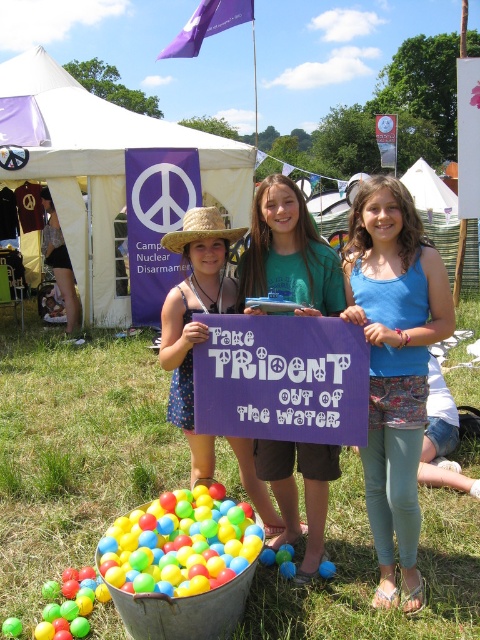
You are a photographer standing at the center of the scene. You want to take a photo that includes both point (384, 467) and point (167, 232). Which point will appear larger in your photo?

Point (384, 467) is closer to the camera than point (167, 232), so it will appear larger in the photo.

You are a photographer standing at the center of the scene. You want to take a photo of the multicolored plastic balls at lower left and the purple flag in the background. How far apart are these two objects from each other?

The multicolored plastic balls at lower left and the purple flag in the background are 7.54 feet apart.